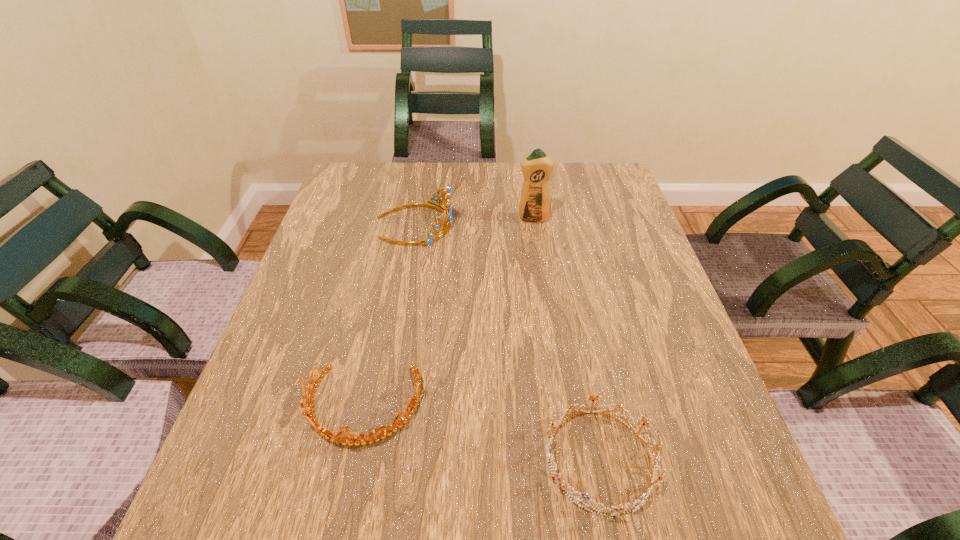
The image size is (960, 540). Find the location of `vacant area between the second shortest object and the detergent`. vacant area between the second shortest object and the detergent is located at coordinates (447, 313).

Locate an element on the screen. vacant space in between the tallest object and the second shortest tiara is located at coordinates (447, 313).

Identify the location of free space that is in between the rightmost tiara and the second shortest object. This screenshot has width=960, height=540. (481, 433).

This screenshot has width=960, height=540. I want to click on free point between the shortest object and the tallest tiara, so click(x=508, y=342).

Where is `vacant area that lies between the second shortest tiara and the tallest object`? vacant area that lies between the second shortest tiara and the tallest object is located at coordinates [x=447, y=313].

Locate an element on the screen. unoccupied area between the tallest tiara and the rightmost tiara is located at coordinates (508, 342).

This screenshot has width=960, height=540. Find the location of `empty space between the rightmost tiara and the third shortest object`. empty space between the rightmost tiara and the third shortest object is located at coordinates (508, 342).

Locate an element on the screen. vacant point located between the second shortest object and the detergent is located at coordinates (447, 313).

I want to click on free spot between the tallest object and the farthest tiara, so click(474, 221).

At what (x,y) coordinates should I click in order to perform the action: click on vacant area that lies between the tallest tiara and the tallest object. Please return your answer as a coordinate pair (x, y). Looking at the image, I should click on (474, 221).